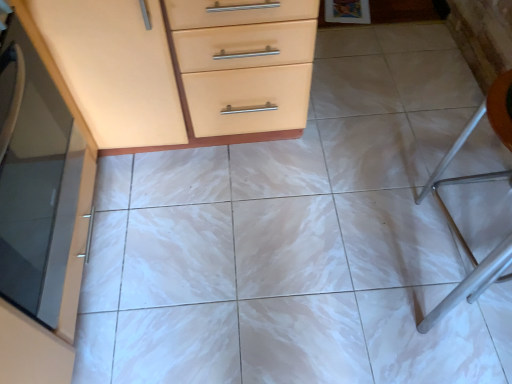
Question: Considering the positions of matte wood chest of drawers at upper left, marked as the 1th chest of drawers in a bottom-to-top arrangement, and orange plastic folding chair at right in the image, is matte wood chest of drawers at upper left, marked as the 1th chest of drawers in a bottom-to-top arrangement, taller or shorter than orange plastic folding chair at right?

Choices:
 (A) short
 (B) tall

Answer: (B)

Question: From a real-world perspective, is matte wood chest of drawers at upper left, placed as the 2th chest of drawers when sorted from top to bottom, positioned above or below orange plastic folding chair at right?

Choices:
 (A) above
 (B) below

Answer: (A)

Question: Which object is the closest to the matte wood chest of drawers at upper left, marked as the 1th chest of drawers in a bottom-to-top arrangement?

Choices:
 (A) matte glass cabinet at left
 (B) matte orange cabinet at upper left, placed as the 1th chest of drawers when sorted from top to bottom
 (C) orange plastic folding chair at right

Answer: (B)

Question: Which of these objects is positioned farthest from the matte orange cabinet at upper left, placed as the 1th chest of drawers when sorted from top to bottom?

Choices:
 (A) matte glass cabinet at left
 (B) matte wood chest of drawers at upper left, placed as the 2th chest of drawers when sorted from top to bottom
 (C) orange plastic folding chair at right

Answer: (C)